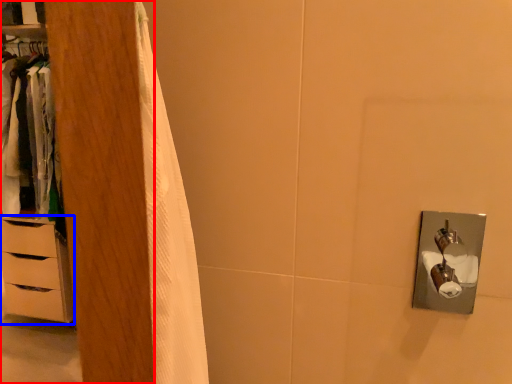
Question: Which of the following is the farthest to the observer, armoire (highlighted by a red box) or chest of drawers (highlighted by a blue box)?

Choices:
 (A) armoire
 (B) chest of drawers

Answer: (B)